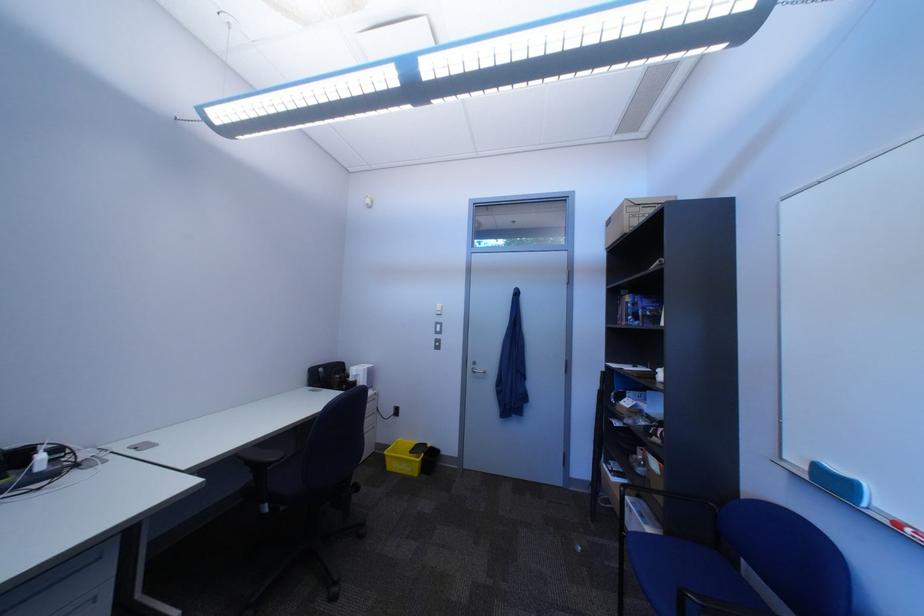
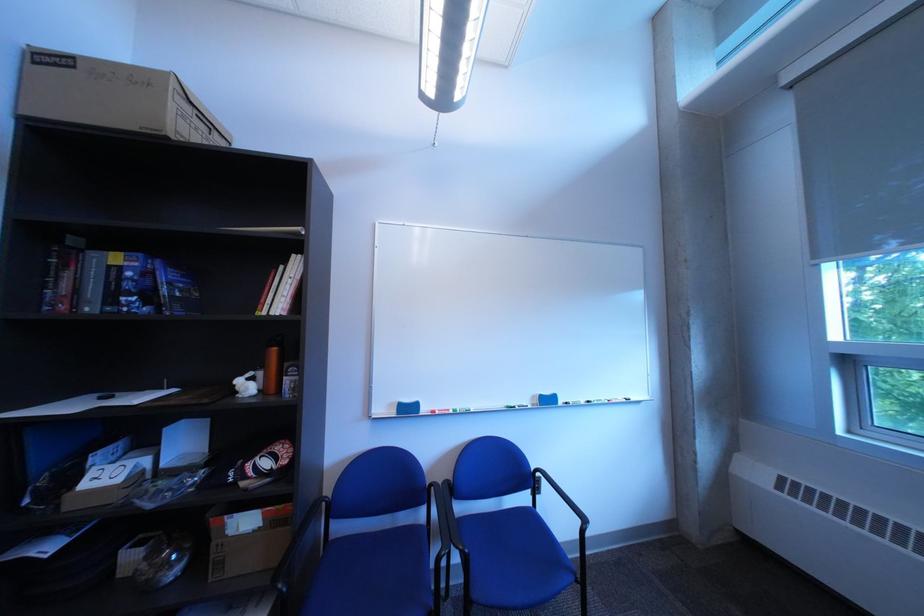
Locate, in the second image, the point that corresponds to point (664, 484) in the first image.

(237, 565)